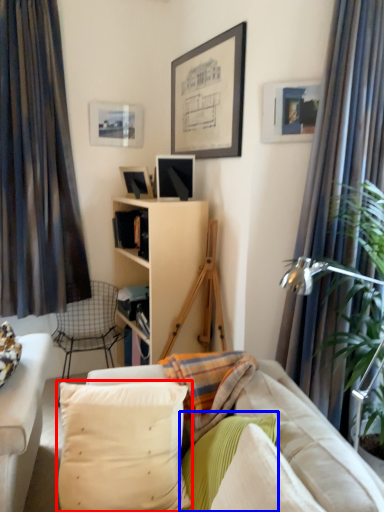
Question: Which point is closer to the camera, pillow (highlighted by a red box) or pillow (highlighted by a blue box)?

Choices:
 (A) pillow
 (B) pillow

Answer: (B)